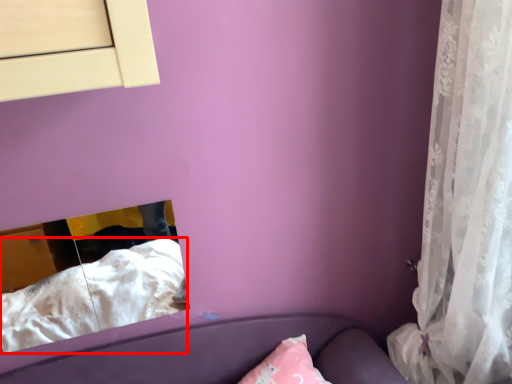
Question: From the image's perspective, what is the correct spatial positioning of sheet (annotated by the red box) in reference to curtain?

Choices:
 (A) above
 (B) below

Answer: (B)